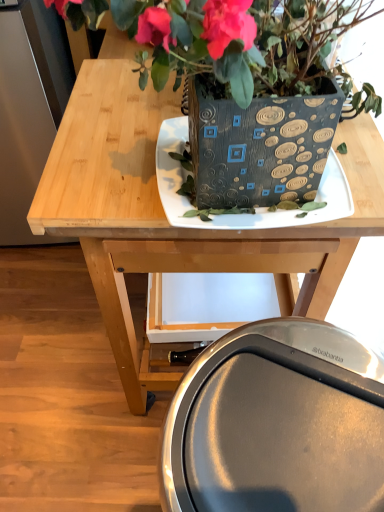
Describe the element at coordinates (277, 423) in the screenshot. Image resolution: width=384 pixels, height=512 pixels. I see `metallic silver swivel chair at lower center` at that location.

Where is `wooden table at center`? Image resolution: width=384 pixels, height=512 pixels. wooden table at center is located at coordinates (165, 216).

This screenshot has width=384, height=512. I want to click on metallic silver swivel chair at lower center, so click(277, 423).

Is wooden table at center shorter than textured black planter at center?

In fact, wooden table at center may be taller than textured black planter at center.

What's the angular difference between wooden table at center and textured black planter at center's facing directions?

They differ by 0.842 degrees in their facing directions.

Is wooden table at center oriented away from textured black planter at center?

No.

In the scene shown: From the image's perspective, is wooden table at center above or below textured black planter at center?

Clearly, from the image's perspective, wooden table at center is below textured black planter at center.

From a real-world perspective, between wooden table at center and metallic silver swivel chair at lower center, who is vertically higher?

wooden table at center.

Which of these two, wooden table at center or metallic silver swivel chair at lower center, is thinner?

metallic silver swivel chair at lower center is thinner.

From the image's perspective, relative to metallic silver swivel chair at lower center, is wooden table at center above or below?

wooden table at center is above metallic silver swivel chair at lower center.

Is wooden table at center not near metallic silver swivel chair at lower center?

No, wooden table at center is not far away from metallic silver swivel chair at lower center.

Is metallic silver swivel chair at lower center positioned with its back to wooden table at center?

No, metallic silver swivel chair at lower center is not facing away from wooden table at center.

Which object is positioned more to the right, metallic silver swivel chair at lower center or wooden table at center?

From the viewer's perspective, metallic silver swivel chair at lower center appears more on the right side.

Is wooden table at center surrounded by metallic silver swivel chair at lower center?

That's incorrect, wooden table at center is not inside metallic silver swivel chair at lower center.

Between metallic silver swivel chair at lower center and wooden table at center, which one is positioned in front?

metallic silver swivel chair at lower center is more forward.

Does textured black planter at center have a greater height compared to matte black plate at center?

Yes, textured black planter at center is taller than matte black plate at center.

Is there a large distance between textured black planter at center and matte black plate at center?

No, textured black planter at center is not far from matte black plate at center.

Between textured black planter at center and matte black plate at center, which one has larger width?

With larger width is textured black planter at center.

How many degrees apart are the facing directions of matte black plate at center and wooden table at center?

5.09 degrees separate the facing orientations of matte black plate at center and wooden table at center.

From the image's perspective, is matte black plate at center located beneath wooden table at center?

Yes, from the image's perspective, matte black plate at center is below wooden table at center.

In the image, is matte black plate at center positioned in front of or behind wooden table at center?

matte black plate at center is in front of wooden table at center.

Between matte black plate at center and wooden table at center, which one has more height?

With more height is wooden table at center.

I want to click on plate located behind the textured black planter at center, so click(255, 208).

Which point is more distant from viewer, (166, 196) or (245, 111)?

The point (166, 196) is more distant.

Can you confirm if matte black plate at center is smaller than textured black planter at center?

Correct, matte black plate at center occupies less space than textured black planter at center.

How far apart are matte black plate at center and textured black planter at center?

matte black plate at center and textured black planter at center are 5.39 inches apart.

Considering the relative positions of matte black plate at center and metallic silver swivel chair at lower center in the image provided, is matte black plate at center in front of metallic silver swivel chair at lower center?

No, matte black plate at center is further to the viewer.

Which is closer, (333,218) or (349,446)?

Point (333,218) is positioned farther from the camera compared to point (349,446).

Is matte black plate at center oriented towards metallic silver swivel chair at lower center?

No.

Find the location of a particular element. The width and height of the screenshot is (384, 512). table behind the textured black planter at center is located at coordinates (165, 216).

Locate an element on the screen. The height and width of the screenshot is (512, 384). table that is on the left side of metallic silver swivel chair at lower center is located at coordinates (165, 216).

Which object lies nearer to the anchor point textured black planter at center, metallic silver swivel chair at lower center or wooden table at center?

wooden table at center is closer to textured black planter at center.

From the image, which object appears to be farther from metallic silver swivel chair at lower center, wooden table at center or textured black planter at center?

Based on the image, textured black planter at center appears to be further to metallic silver swivel chair at lower center.

Looking at the image, which one is located closer to matte black plate at center, metallic silver swivel chair at lower center or textured black planter at center?

The object closer to matte black plate at center is textured black planter at center.

Considering their positions, is wooden table at center positioned further to matte black plate at center than textured black planter at center?

wooden table at center is positioned further to the anchor matte black plate at center.

Based on their spatial positions, is textured black planter at center or matte black plate at center closer to metallic silver swivel chair at lower center?

matte black plate at center is closer to metallic silver swivel chair at lower center.

When comparing their distances from wooden table at center, does textured black planter at center or matte black plate at center seem further?

Answer: textured black planter at center lies further to wooden table at center than the other object.

Looking at the image, which one is located further to matte black plate at center, textured black planter at center or wooden table at center?

wooden table at center is positioned further to the anchor matte black plate at center.

Looking at this image, based on their spatial positions, is wooden table at center or matte black plate at center closer to metallic silver swivel chair at lower center?

matte black plate at center is positioned closer to the anchor metallic silver swivel chair at lower center.

Image resolution: width=384 pixels, height=512 pixels. I want to click on plate between textured black planter at center and wooden table at center along the z-axis, so click(255, 208).

Where is `plate between wooden table at center and metallic silver swivel chair at lower center vertically`? plate between wooden table at center and metallic silver swivel chair at lower center vertically is located at coordinates (255, 208).

The width and height of the screenshot is (384, 512). I want to click on plate between textured black planter at center and metallic silver swivel chair at lower center in the up-down direction, so click(x=255, y=208).

You are a GUI agent. You are given a task and a screenshot of the screen. Output one action in this format:
    pyautogui.click(x=<x>, y=<y>)
    Task: Click on the table between textured black planter at center and metallic silver swivel chair at lower center vertically
    
    Given the screenshot: What is the action you would take?
    pyautogui.click(x=165, y=216)